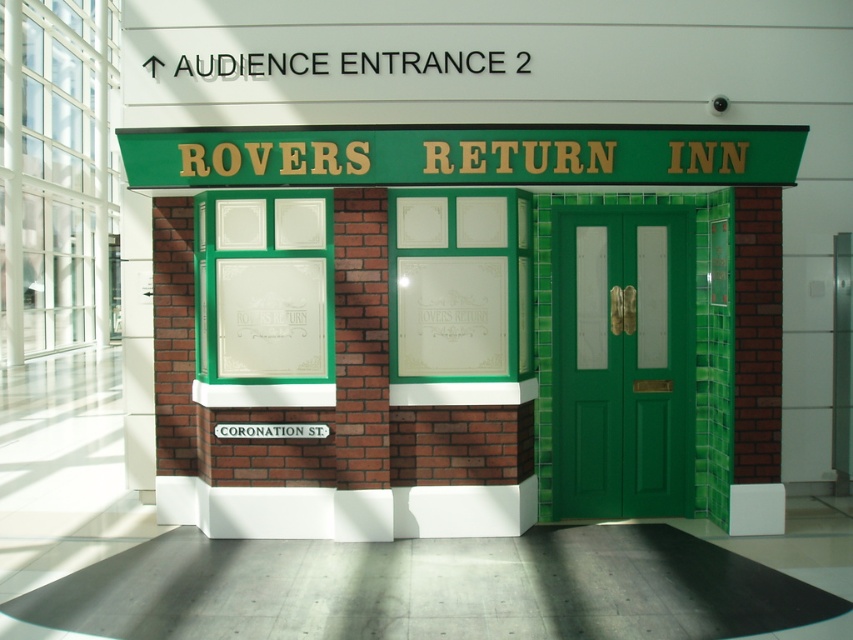
You are a delivery person trying to locate the entrance to the Rovers Return Inn. You see the green brick storefront at center and the black plastic sign at upper center. Which object is larger and can help you identify the main entrance?

The green brick storefront at center is bigger than the black plastic sign at upper center, so the larger green brick storefront at center is more likely to indicate the main entrance.

You are a visitor approaching the entrance of the Rovers Return Inn. You see the green wooden door at center and the black plastic sign at upper center. Which object is nearer to you as you approach the entrance?

The green wooden door at center is closer to the viewer than the black plastic sign at upper center, so the green wooden door at center is nearer to you as you approach the entrance.

You are standing in front of the building and want to locate the green brick storefront at center. According to the coordinates provided, where exactly is it positioned?

The green brick storefront at center is located at point coordinates (405, 316), which places it precisely at the center of the building facade.